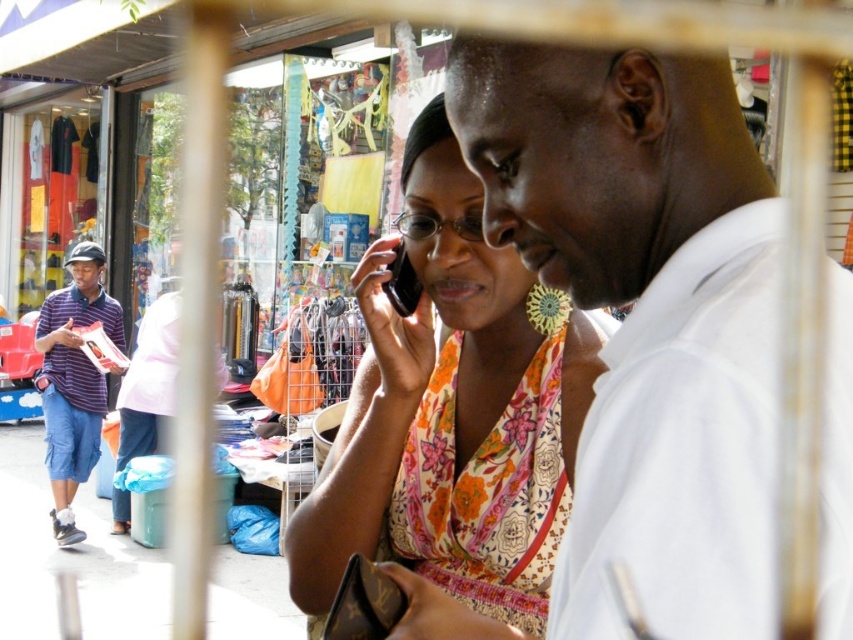
Is striped polo shirt at left shorter than black plastic phone at center?

No.

In the scene shown: Is the position of striped polo shirt at left more distant than that of black plastic phone at center?

That is True.

Is point (61, 387) more distant than point (401, 308)?

That is True.

Identify the location of striped polo shirt at left. The height and width of the screenshot is (640, 853). (73, 380).

Between floral fabric dress at center and black plastic phone at center, which one has more height?

floral fabric dress at center is taller.

Does floral fabric dress at center have a greater height compared to black plastic phone at center?

Yes, floral fabric dress at center is taller than black plastic phone at center.

Does point (428, 419) come in front of point (416, 284)?

No, it is behind (416, 284).

Where is `floral fabric dress at center`? floral fabric dress at center is located at coordinates (453, 410).

From the picture: Between white cotton shirt at center and floral fabric dress at center, which one appears on the left side from the viewer's perspective?

floral fabric dress at center

Image resolution: width=853 pixels, height=640 pixels. What do you see at coordinates (645, 316) in the screenshot? I see `white cotton shirt at center` at bounding box center [645, 316].

In order to click on white cotton shirt at center in this screenshot , I will do `click(645, 316)`.